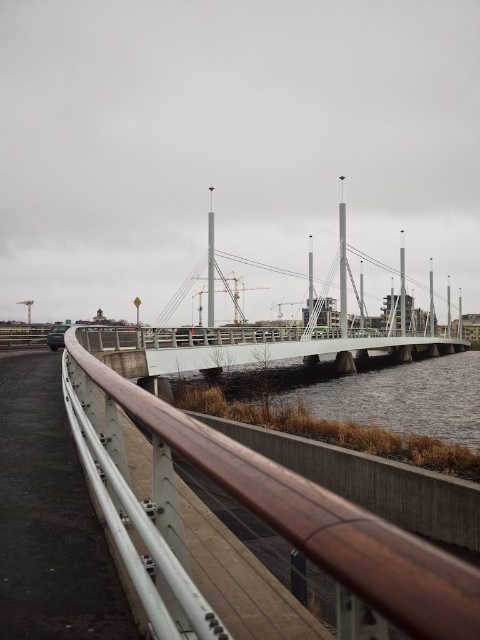
Question: Estimate the real-world distances between objects in this image. Which object is farther from the white concrete bridge at center?

Choices:
 (A) metallic silver car at left
 (B) brown metallic rail at lower left

Answer: (A)

Question: Does brown metallic rail at lower left appear on the left side of white concrete bridge at center?

Choices:
 (A) no
 (B) yes

Answer: (B)

Question: Which point is closer to the camera taking this photo?

Choices:
 (A) coord(52,348)
 (B) coord(348,605)
 (C) coord(129,348)

Answer: (B)

Question: From the image, what is the correct spatial relationship of white concrete bridge at center in relation to metallic silver car at left?

Choices:
 (A) left
 (B) right

Answer: (B)

Question: Which object is farther from the camera taking this photo?

Choices:
 (A) metallic silver car at left
 (B) brown metallic rail at lower left
 (C) white concrete bridge at center

Answer: (A)

Question: Does brown metallic rail at lower left have a larger size compared to white concrete bridge at center?

Choices:
 (A) yes
 (B) no

Answer: (B)